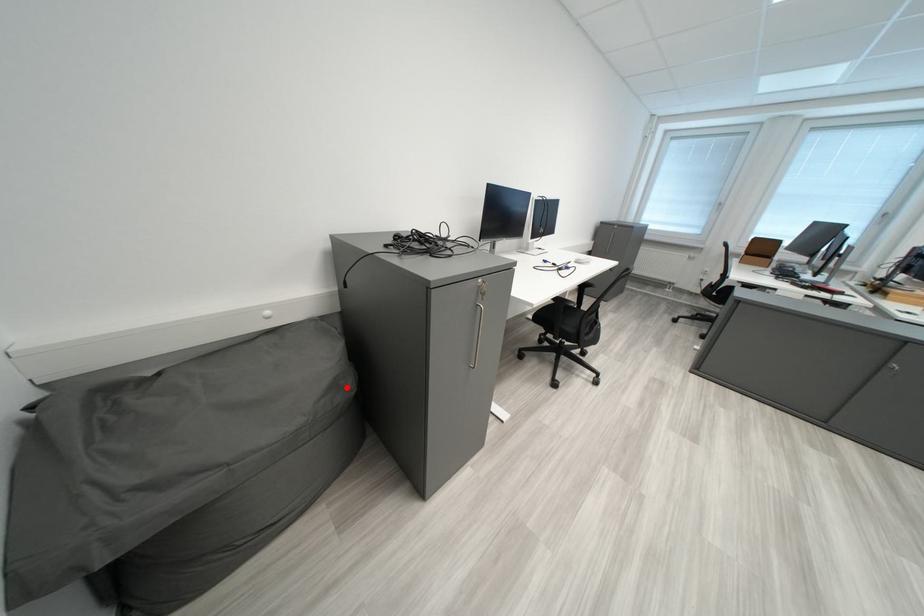
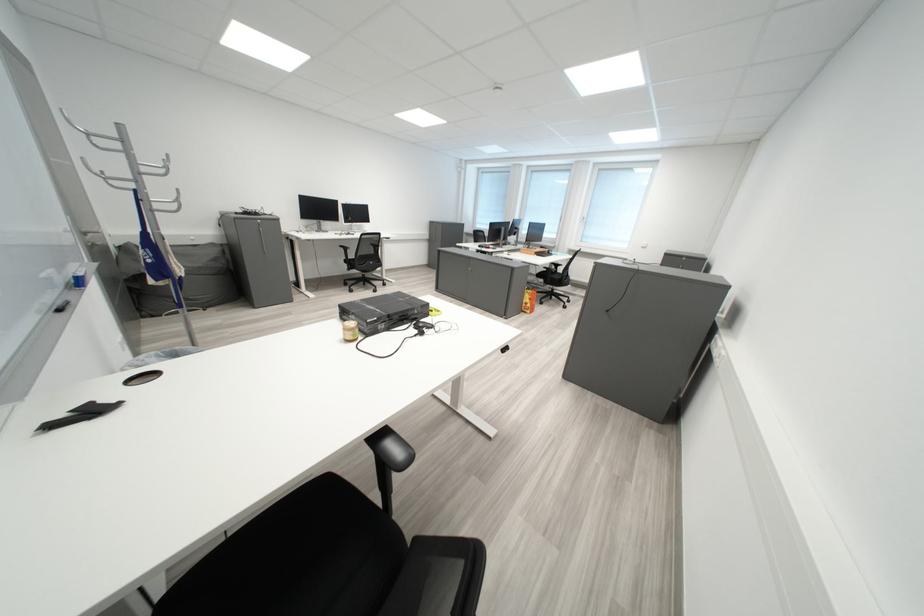
Locate, in the second image, the point that corresponds to the highlighted location in the first image.

(228, 262)